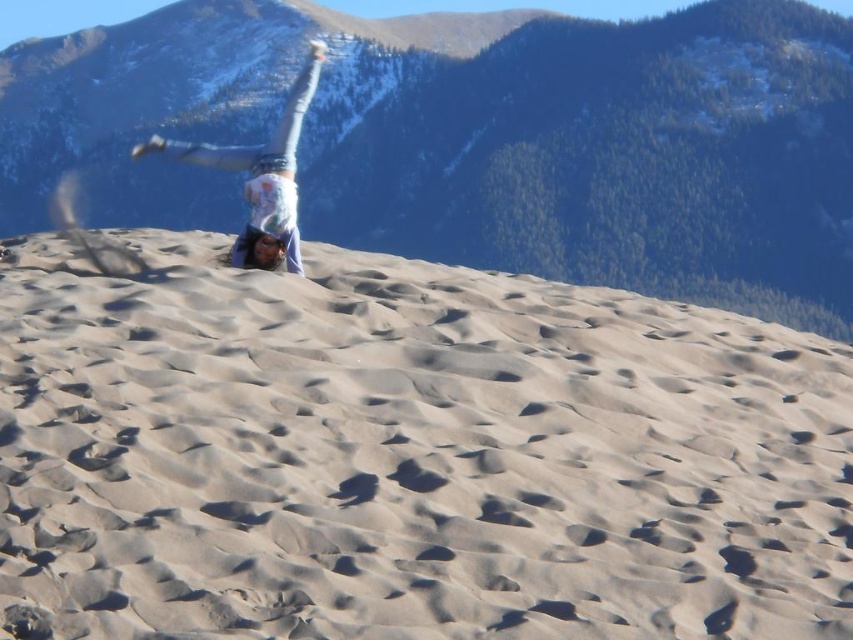
You are a photographer trying to capture the entire scene of the green forested mountain at upper center and the light blue denim jeans at upper center in one shot. Based on their sizes, which object will occupy more of the frame?

The green forested mountain at upper center is larger in size than the light blue denim jeans at upper center, so it will occupy more of the frame.

You are a photographer positioned at the base of the sand dune. You want to capture a photo that includes both the green forested mountain at upper center and the light blue denim jeans at upper center. Based on their positions, which object should you adjust your camera to focus on first to ensure both are in the frame?

The green forested mountain at upper center is to the right of the light blue denim jeans at upper center. To include both in the frame, you should first focus on the light blue denim jeans at upper center, as it is positioned to the left, ensuring there is enough space to capture the mountain to its right.

You are a photographer trying to capture the perfect shot of the smooth beige sand at center and the light blue denim jeans at upper center. To ensure both elements are in frame, which direction should you adjust your camera? Explain your reasoning based on their positions.

The smooth beige sand at center is to the right of the light blue denim jeans at upper center. To include both in the frame, you should adjust your camera to the left so that the light blue denim jeans at upper center moves towards the center while the smooth beige sand at center remains within the frame.